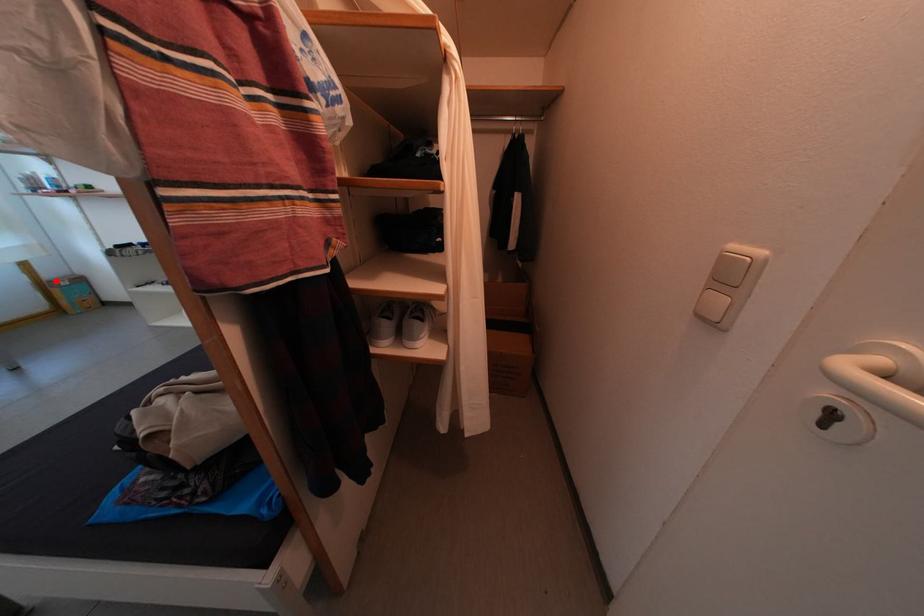
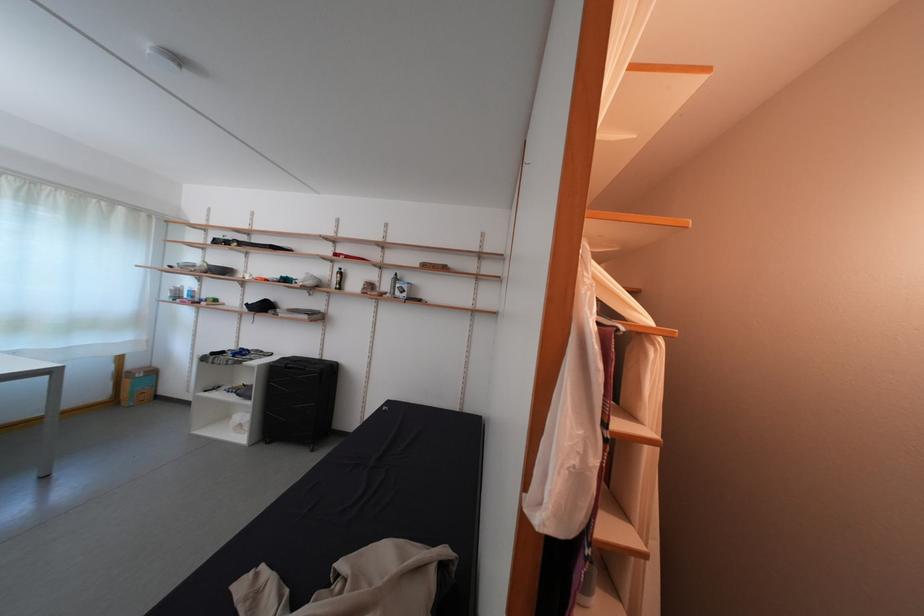
Question: A red point is marked in image1. In image2, is the corresponding 3D point closer to the camera or farther? Reply with the corresponding letter.

Choices:
 (A) The corresponding 3D point is closer.
 (B) The corresponding 3D point is farther.

Answer: (A)